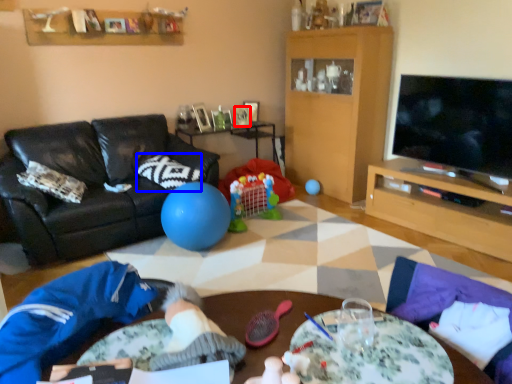
Question: Among these objects, which one is nearest to the camera, picture frame (highlighted by a red box) or pillow (highlighted by a blue box)?

Choices:
 (A) picture frame
 (B) pillow

Answer: (B)